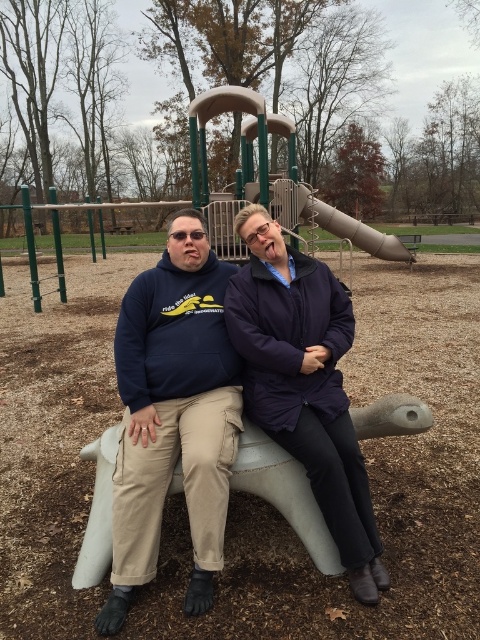
Does matte blue hoodie at center appear over navy blue hoodie at center?

Yes, matte blue hoodie at center is above navy blue hoodie at center.

Does point (155, 500) lie behind point (120, 618)?

Yes, point (155, 500) is behind point (120, 618).

Between point (305, 429) and point (157, 460), which one is positioned in front?

Positioned in front is point (157, 460).

Identify the location of matte blue hoodie at center. Image resolution: width=480 pixels, height=640 pixels. (304, 385).